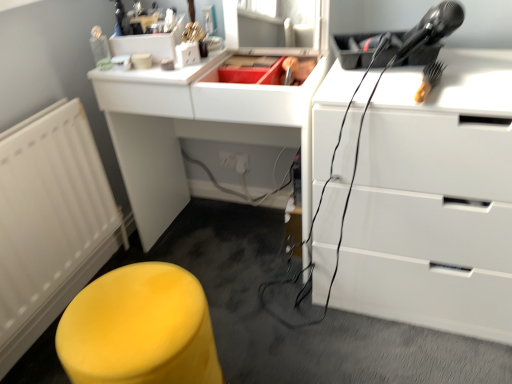
Identify the location of free region under white glossy computer desk at center (from a real-world perspective). The width and height of the screenshot is (512, 384). (230, 238).